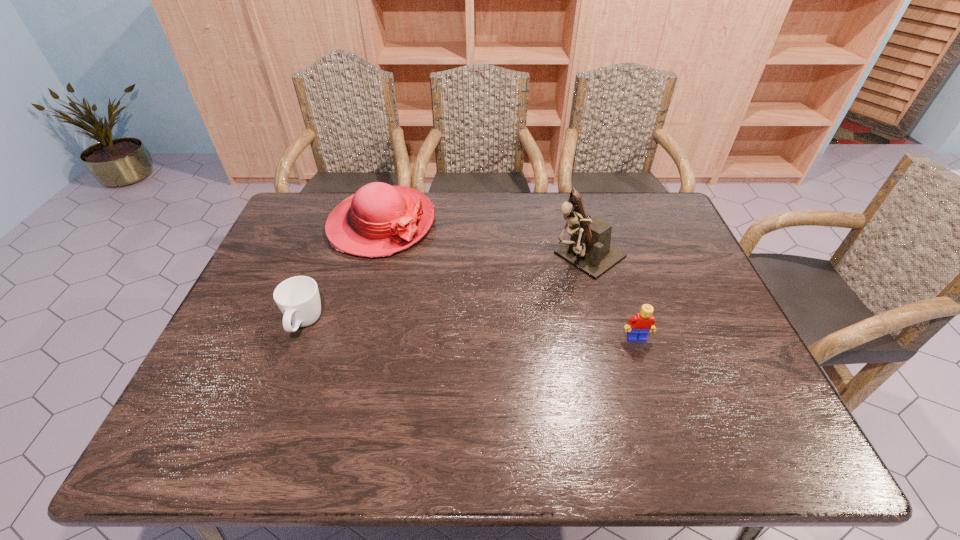
Find the location of `vacant spot on the desktop that is between the cup and the Lego and is positioned on the front-facing side of the figurine`. vacant spot on the desktop that is between the cup and the Lego and is positioned on the front-facing side of the figurine is located at coordinates (477, 332).

This screenshot has height=540, width=960. In order to click on vacant space on the desktop that is between the cup and the Lego and is positioned at the front of the hat with a bow in this screenshot , I will do `click(480, 332)`.